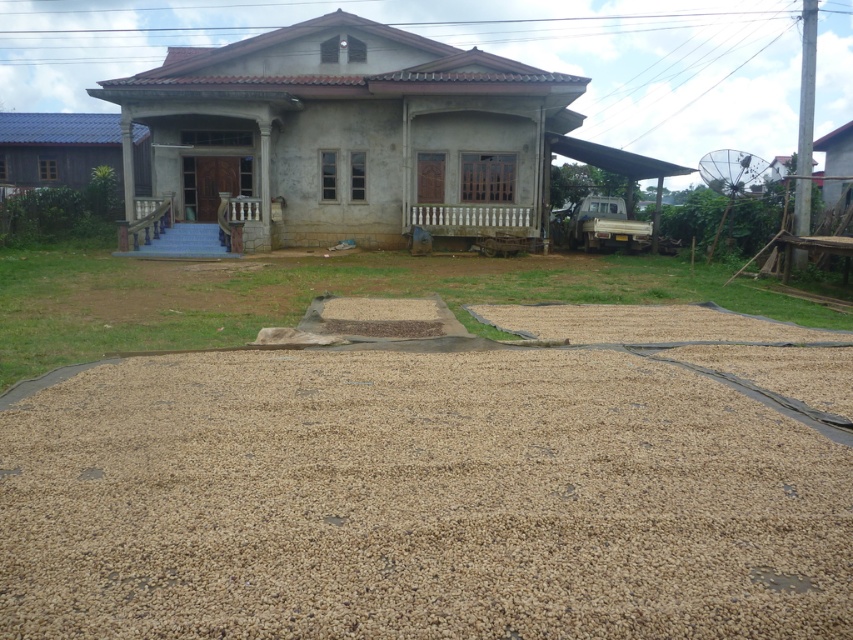
Question: Where is light brown gravel at center located in relation to brown gravel at center in the image?

Choices:
 (A) above
 (B) below

Answer: (B)

Question: Which object is farther from the camera taking this photo?

Choices:
 (A) brown gravel at center
 (B) light brown gravel at center

Answer: (A)

Question: Is light brown gravel at center smaller than brown gravel at center?

Choices:
 (A) yes
 (B) no

Answer: (A)

Question: Does light brown gravel at center have a smaller size compared to brown gravel at center?

Choices:
 (A) no
 (B) yes

Answer: (B)

Question: Which point appears closest to the camera in this image?

Choices:
 (A) pos(74,291)
 (B) pos(666,557)

Answer: (B)